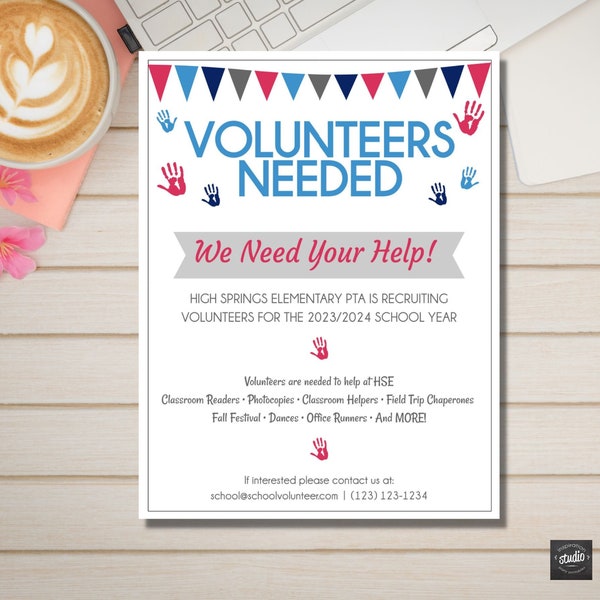
Image resolution: width=600 pixels, height=600 pixels. Find the location of `latte cup`. latte cup is located at coordinates (x=48, y=91).